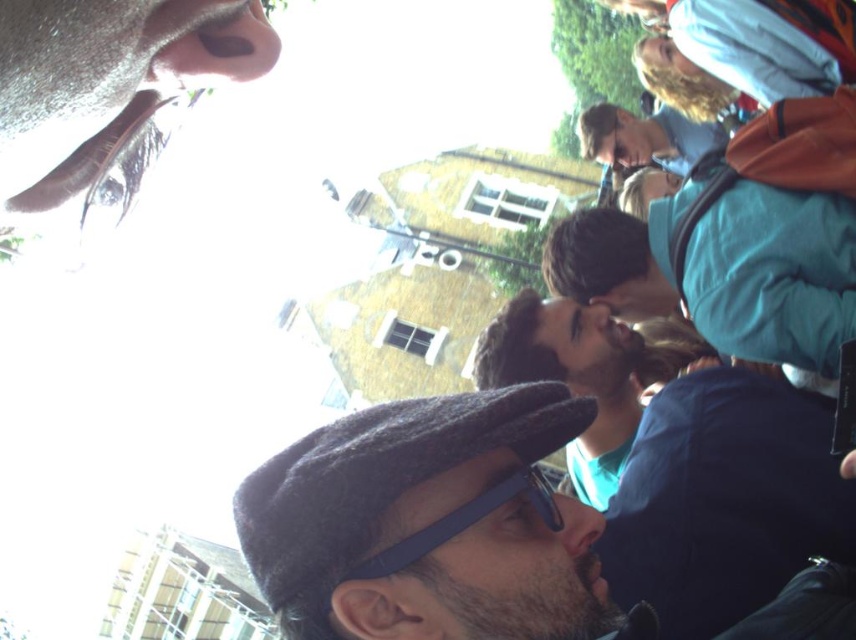
Can you confirm if dark gray wool cap at center is positioned above matte skin nose at center?

Correct, dark gray wool cap at center is located above matte skin nose at center.

Identify the location of dark gray wool cap at center. The image size is (856, 640). pos(421,524).

Does point (205, 72) come in front of point (580, 550)?

Yes.

Can you confirm if matte brown nose at upper left is positioned above matte skin nose at center?

Yes.

Does point (241, 33) come farther from viewer compared to point (566, 515)?

No, (241, 33) is closer to viewer.

Locate an element on the screen. matte brown nose at upper left is located at coordinates [x=209, y=44].

Based on the photo, is matte brown nose at upper left thinner than blue rubber goggles at center?

→ Yes.

Does point (238, 36) come closer to viewer compared to point (490, 496)?

Yes, point (238, 36) is in front of point (490, 496).

I want to click on matte brown nose at upper left, so click(209, 44).